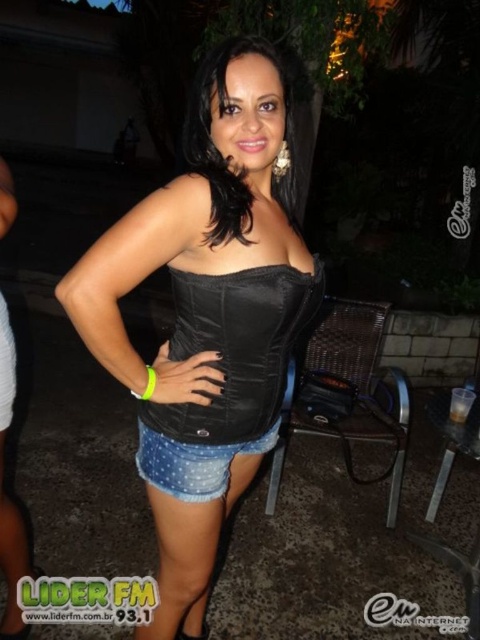
Question: Where is black leather top at center located in relation to denim shorts at lower center in the image?

Choices:
 (A) right
 (B) left

Answer: (B)

Question: Does black leather top at center appear on the left side of black satin corset at center?

Choices:
 (A) yes
 (B) no

Answer: (A)

Question: Which point is farther from the camera taking this photo?

Choices:
 (A) (192, 490)
 (B) (277, 296)

Answer: (A)

Question: Considering the real-world distances, which object is closest to the denim shorts at lower center?

Choices:
 (A) black satin corset at center
 (B) black leather top at center
 (C) black leather corset at center

Answer: (C)

Question: Is black leather top at center thinner than black satin corset at center?

Choices:
 (A) yes
 (B) no

Answer: (B)

Question: Which object is farther from the camera taking this photo?

Choices:
 (A) black leather top at center
 (B) denim shorts at lower center

Answer: (B)